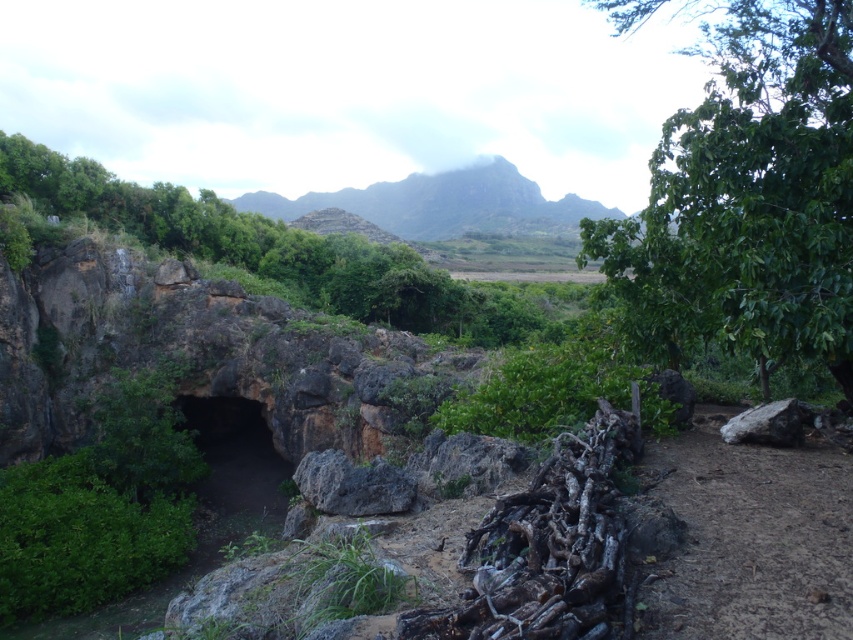
You are a hiker with a 60 feet long rope. You need to cross a gap between the green mossy cave at center and the gray rough rock at right. Can your rope reach the other side?

The distance between the green mossy cave at center and the gray rough rock at right is 68.59 feet. Since your rope is only 60 feet long, it is not long enough to span the gap. You will need a longer rope or an alternative method to cross.

You are an explorer trying to navigate through the rocky terrain. You notice the rough textured rock at center and the gray rough rock at right. Which rock is taller?

The rough textured rock at center is not as tall as the gray rough rock at right, so the gray rough rock at right is taller.